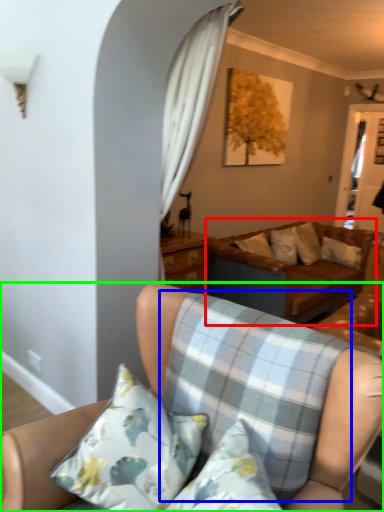
Question: Based on their relative distances, which object is farther from studio couch (highlighted by a red box)? Choose from plaid (highlighted by a blue box) and studio couch (highlighted by a green box).

Choices:
 (A) plaid
 (B) studio couch

Answer: (B)